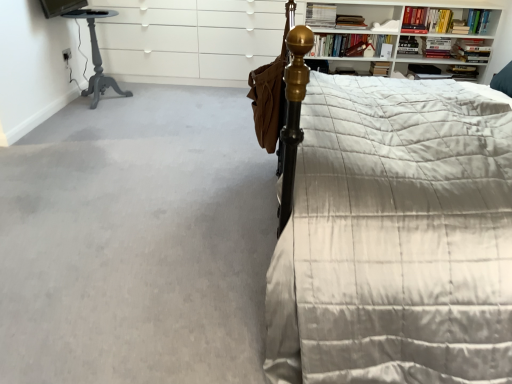
Question: Does hardcover book at upper center, which is the 1th book in left-to-right order, contain hardcover book at upper right, positioned as the fourth book in right-to-left order?

Choices:
 (A) no
 (B) yes

Answer: (A)

Question: Is hardcover book at upper center, which is the 1th book in left-to-right order, taller than hardcover book at upper right, which is the fifth book in left-to-right order?

Choices:
 (A) yes
 (B) no

Answer: (A)

Question: From a real-world perspective, is hardcover book at upper center, which ranks as the eighth book in right-to-left order, over hardcover book at upper right, positioned as the fourth book in right-to-left order?

Choices:
 (A) no
 (B) yes

Answer: (B)

Question: Is hardcover book at upper center, which is the 1th book in left-to-right order, shorter than hardcover book at upper right, which is the fifth book in left-to-right order?

Choices:
 (A) yes
 (B) no

Answer: (B)

Question: Is there a large distance between hardcover book at upper center, which ranks as the eighth book in right-to-left order, and hardcover book at upper right, which is the fifth book in left-to-right order?

Choices:
 (A) yes
 (B) no

Answer: (A)

Question: Could you tell me if hardcover book at upper center, which ranks as the eighth book in right-to-left order, is turned towards hardcover book at upper right, positioned as the fourth book in right-to-left order?

Choices:
 (A) yes
 (B) no

Answer: (B)

Question: Does hardcover book at upper center, the 7th book positioned from the right, appear on the right side of gray carpet at lower left?

Choices:
 (A) yes
 (B) no

Answer: (A)

Question: Does hardcover book at upper center, the second book in the left-to-right sequence, have a lesser width compared to gray carpet at lower left?

Choices:
 (A) no
 (B) yes

Answer: (B)

Question: Is hardcover book at upper center, the second book in the left-to-right sequence, wider than gray carpet at lower left?

Choices:
 (A) yes
 (B) no

Answer: (B)

Question: Does hardcover book at upper center, the second book in the left-to-right sequence, appear on the left side of gray carpet at lower left?

Choices:
 (A) yes
 (B) no

Answer: (B)

Question: From the image's perspective, is hardcover book at upper center, the second book in the left-to-right sequence, above gray carpet at lower left?

Choices:
 (A) yes
 (B) no

Answer: (A)

Question: Is hardcover book at upper center, the 7th book positioned from the right, not within gray carpet at lower left?

Choices:
 (A) no
 (B) yes

Answer: (B)

Question: Does matte gold bedpost at upper right have a smaller size compared to hardcover book at upper right, which is the seventh book in left-to-right order?

Choices:
 (A) no
 (B) yes

Answer: (A)